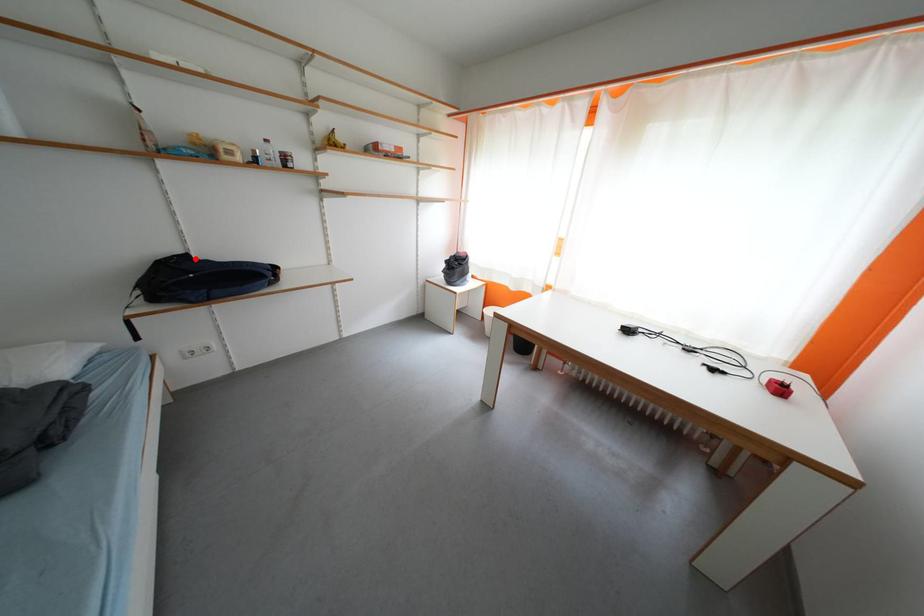
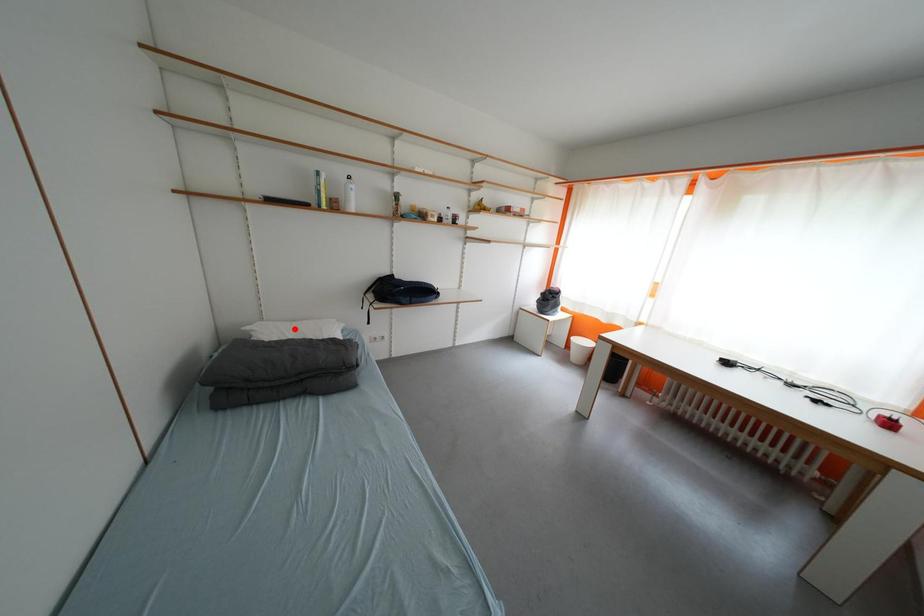
I am providing you with two images of the same scene from different viewpoints. A red point is marked on the first image and another point is marked on the second image. Is the red point in image1 aligned with the point shown in image2?

No